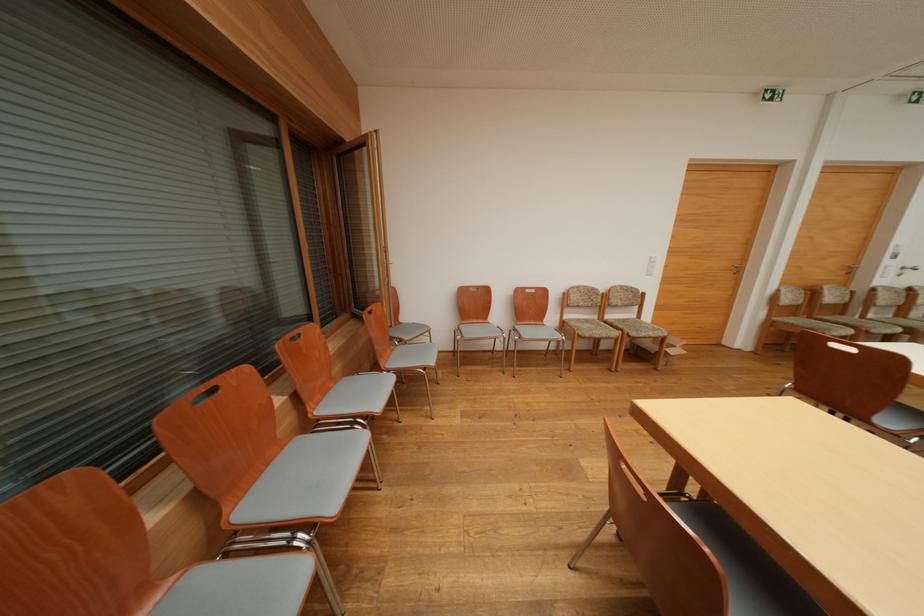
What do you see at coordinates (906, 270) in the screenshot? I see `a window handle` at bounding box center [906, 270].